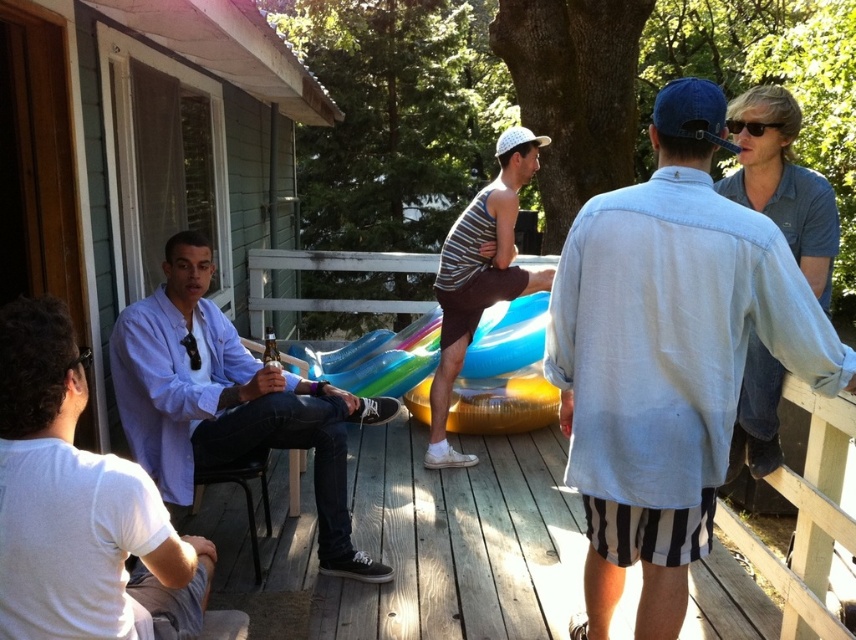
You are standing on the wooden deck and want to hand a drink to the person wearing the denim shirt at upper right. Considering your arm reaches 1.6 meters, will you be able to reach them without moving?

The denim shirt at upper right is 1.77 meters away from you, which is slightly beyond your 1.6 meter reach. You will need to move closer to hand them the drink.

You are a photographer trying to capture a group photo of the denim shirt at upper right and the light purple shirt at left. Based on their heights, which person should you position closer to the camera to ensure both are fully visible in the photo?

The denim shirt at upper right is taller than the light purple shirt at left, so you should position the light purple shirt at left closer to the camera to ensure both are fully visible in the photo.

You are at an outdoor gathering on a wooden deck surrounded by greenery. You see a white cotton shirt at left and a blue denim shirt at upper right. Which shirt is positioned more to the left side of the scene?

The white cotton shirt at left is positioned more to the left side of the scene compared to the blue denim shirt at upper right.